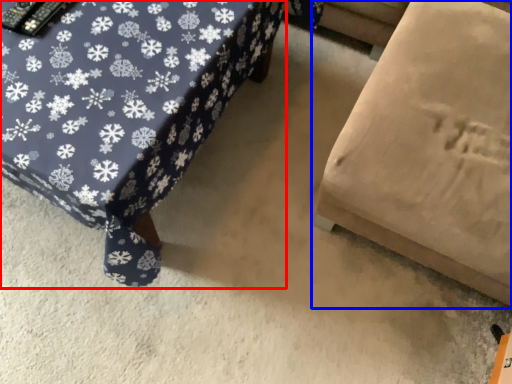
Question: Which of the following is the closest to the observer, furniture (highlighted by a red box) or furniture (highlighted by a blue box)?

Choices:
 (A) furniture
 (B) furniture

Answer: (B)